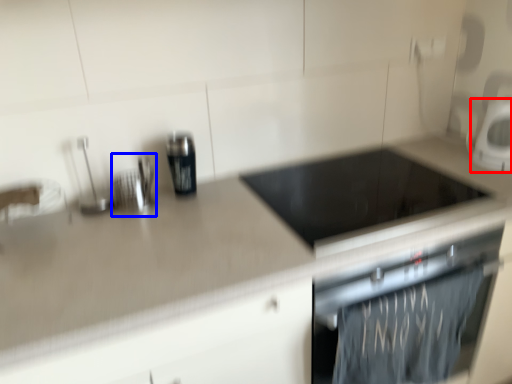
Question: Which of the following is the closest to the observer, kitchen appliance (highlighted by a red box) or appliance (highlighted by a blue box)?

Choices:
 (A) kitchen appliance
 (B) appliance

Answer: (B)